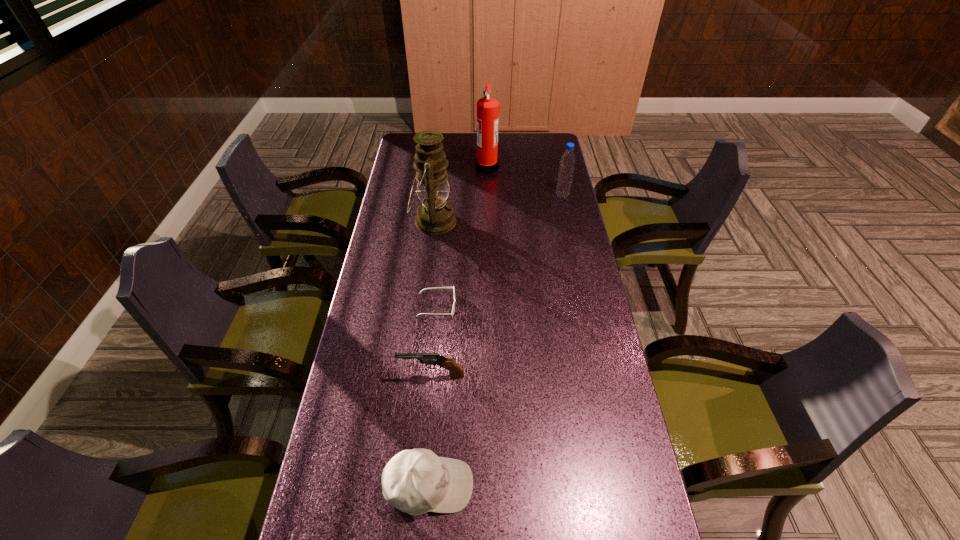
Where is `gun that is at the left edge`? The height and width of the screenshot is (540, 960). gun that is at the left edge is located at coordinates (456, 371).

The width and height of the screenshot is (960, 540). What are the coordinates of `baseball cap located in the left edge section of the desktop` in the screenshot? It's located at (417, 481).

I want to click on object present at the right edge, so click(x=567, y=161).

Where is `free space at the far edge`? free space at the far edge is located at coordinates (507, 144).

Image resolution: width=960 pixels, height=540 pixels. Identify the location of vacant area at the left edge. (389, 255).

The height and width of the screenshot is (540, 960). Identify the location of blank area at the right edge. (566, 200).

You are a GUI agent. You are given a task and a screenshot of the screen. Output one action in this format:
    pyautogui.click(x=<x>, y=<y>)
    Task: Click on the vacant space at the far right corner
    The width and height of the screenshot is (960, 540).
    Given the screenshot: What is the action you would take?
    pyautogui.click(x=525, y=139)

You are a GUI agent. You are given a task and a screenshot of the screen. Output one action in this format:
    pyautogui.click(x=<x>, y=<y>)
    Task: Click on the empty space that is in between the sunglasses and the oil lamp
    Image resolution: width=960 pixels, height=540 pixels.
    Given the screenshot: What is the action you would take?
    pyautogui.click(x=435, y=264)

Find the location of a particular element. vacant space that's between the farthest object and the gun is located at coordinates (460, 272).

Where is `free space between the fourth nearest object and the second nearest object`? This screenshot has height=540, width=960. free space between the fourth nearest object and the second nearest object is located at coordinates (433, 299).